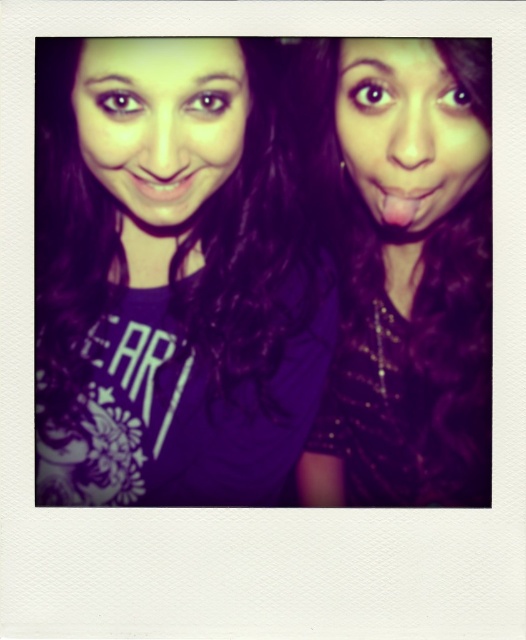
Does purple matte shirt at center come behind purple sequined dress at center?

That is False.

Between purple matte shirt at center and purple sequined dress at center, which one has more height?

With more height is purple sequined dress at center.

Does point (217, 180) lie in front of point (480, 246)?

Yes.

You are a GUI agent. You are given a task and a screenshot of the screen. Output one action in this format:
    pyautogui.click(x=<x>, y=<y>)
    Task: Click on the purple matte shirt at center
    Image resolution: width=526 pixels, height=640 pixels.
    Given the screenshot: What is the action you would take?
    pyautogui.click(x=173, y=278)

Is point (342, 125) positioned behind point (197, 182)?

That is True.

Between point (460, 99) and point (180, 179), which one is positioned in front?

Point (460, 99) is in front.

I want to click on matte skin at upper right, so click(407, 132).

Describe the element at coordinates (160, 122) in the screenshot. I see `matte skin at upper left` at that location.

Locate an element on the screen. The image size is (526, 640). matte skin at upper left is located at coordinates (160, 122).